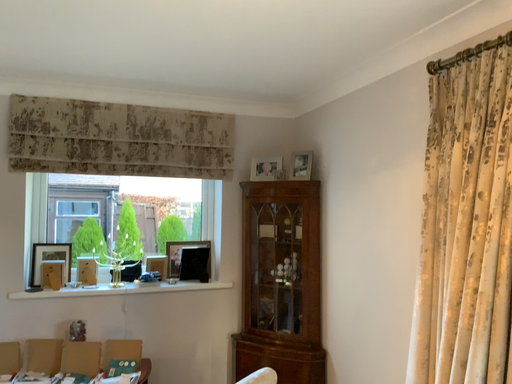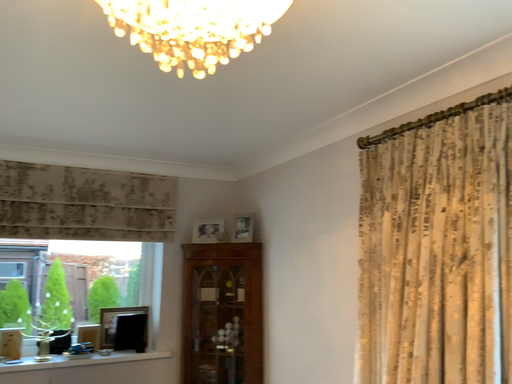
Question: Which way did the camera rotate in the video?

Choices:
 (A) rotated upward
 (B) rotated downward

Answer: (A)